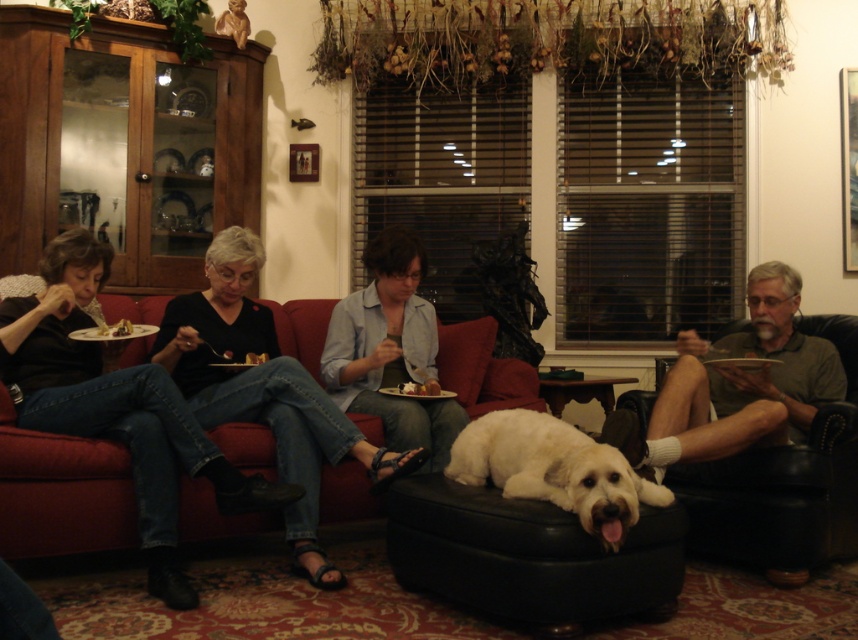
Question: Which of the following is the closest to the observer?

Choices:
 (A) (754, 442)
 (B) (472, 346)
 (C) (514, 436)
 (D) (196, 403)

Answer: (C)

Question: Is gray-green shirt at right behind chocolate cake at left?

Choices:
 (A) yes
 (B) no

Answer: (B)

Question: Which object appears closest to the camera in this image?

Choices:
 (A) gray-green shirt at right
 (B) smooth chocolate cake at center

Answer: (A)

Question: Is white fluffy dog at center positioned behind smooth chocolate cake at center?

Choices:
 (A) no
 (B) yes

Answer: (A)

Question: Which is nearer to the smooth chocolate cake at center?

Choices:
 (A) white fluffy dog at center
 (B) smooth leather couch at center

Answer: (B)

Question: Can you confirm if smooth leather couch at center is bigger than chocolate cake at left?

Choices:
 (A) no
 (B) yes

Answer: (B)